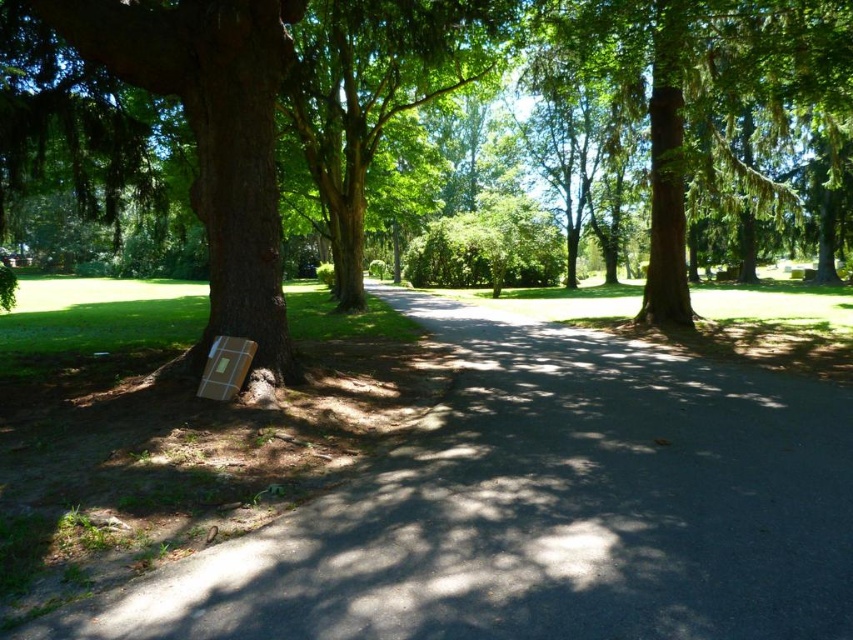
You are a delivery person who needs to place a new box next to the existing one. The new box is the same size as the brown textured trunk at left. Will it fit next to the brown cardboard box at left without overlapping?

The brown cardboard box at left has a width less than the brown textured trunk at left. Since the new box is the same size as the trunk, it will be wider than the existing cardboard box. Therefore, placing it next to the brown cardboard box at left may cause overlapping unless there is sufficient space.

You are a park visitor walking along the paved path that curves to the right. You see the brown cardboard box at left and the green textured tree at center. Which object is closer to your current position when you are standing on the path near the tree?

The brown cardboard box at left is to the left of the green textured tree at center, so when standing near the tree on the path, the green textured tree at center is closer to your current position.

From the picture: You are a park visitor who wants to place a picnic blanket near the brown textured trunk at left but need to avoid the brown cardboard box at left. Which direction should you move from the trunk to stay clear of the box?

The brown cardboard box at left is to the right of the brown textured trunk at left. To avoid it, move to the left side of the trunk away from the box.